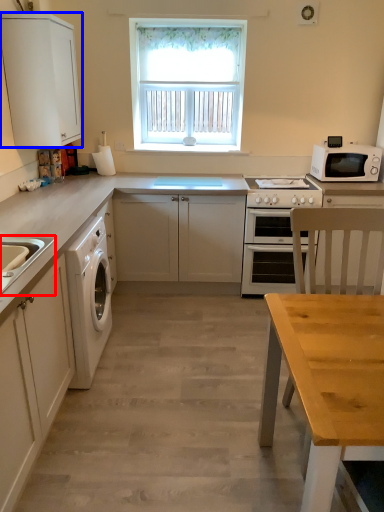
Question: Among these objects, which one is nearest to the camera, sink (highlighted by a red box) or cabinetry (highlighted by a blue box)?

Choices:
 (A) sink
 (B) cabinetry

Answer: (A)